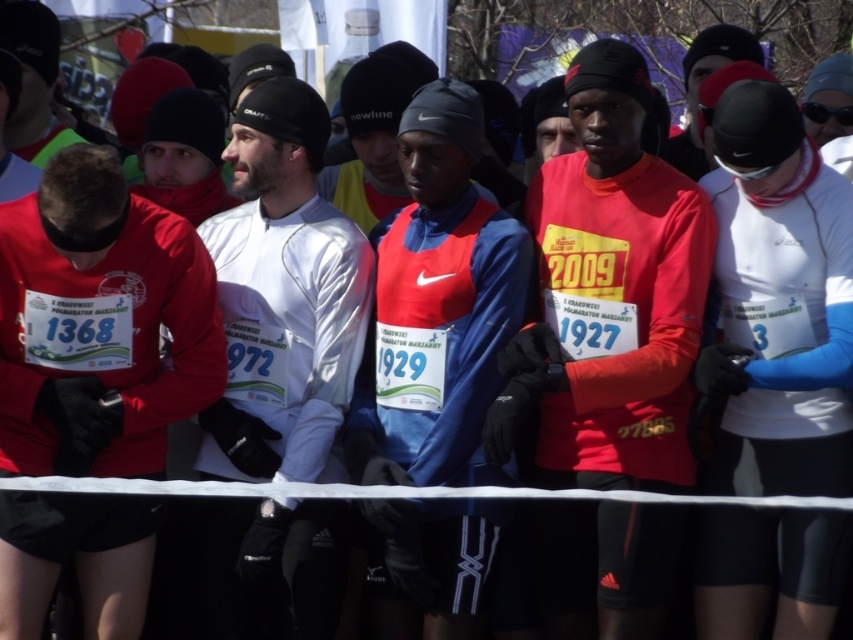
Consider the image. Can you confirm if white matte jacket at center is positioned to the right of blue fabric jacket at center?

No, white matte jacket at center is not to the right of blue fabric jacket at center.

Is white matte jacket at center further to camera compared to blue fabric jacket at center?

Yes, white matte jacket at center is behind blue fabric jacket at center.

Between point (309, 296) and point (525, 234), which one is positioned behind?

Positioned behind is point (525, 234).

Identify the location of white matte jacket at center. The width and height of the screenshot is (853, 640). (283, 296).

Does matte red shirt at center have a greater height compared to white matte jacket at center?

No, matte red shirt at center is not taller than white matte jacket at center.

Looking at this image, is matte red shirt at center shorter than white matte jacket at center?

Indeed, matte red shirt at center has a lesser height compared to white matte jacket at center.

Between point (619, 163) and point (242, 545), which one is positioned in front?

Point (242, 545) is in front.

Where is `matte red shirt at center`? This screenshot has height=640, width=853. matte red shirt at center is located at coordinates 608,296.

Can you confirm if matte red shirt at center is shorter than white matte running suit at center?

Yes.

Which is behind, point (675, 205) or point (721, 390)?

The point (675, 205) is more distant.

Describe the element at coordinates (608, 296) in the screenshot. Image resolution: width=853 pixels, height=640 pixels. I see `matte red shirt at center` at that location.

Identify the location of matte red shirt at center. The height and width of the screenshot is (640, 853). (608, 296).